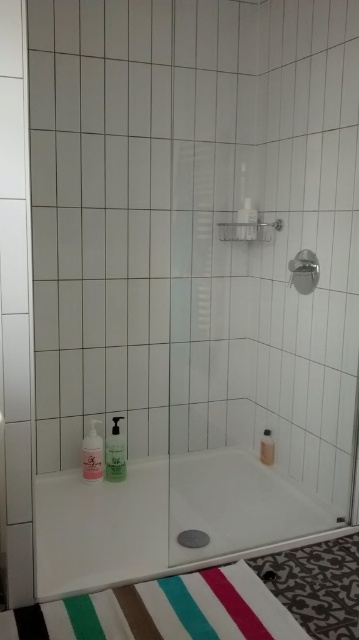
You are a contractor assessing the bathroom layout. You need to install a new showerhead that requires a minimum of 2 meters of clearance from the floor to the ceiling. Given the height difference between the white glossy bathtub at lower center and the white matte screen door at left, can you determine if the showerhead will fit?

The white glossy bathtub at lower center has a lesser height compared to the white matte screen door at left, but without specific measurements of the total ceiling height, it is impossible to confirm if the showerhead will fit. The height difference between the two objects does not provide information about the overall room height required for the installation.

You are designing a layout for a new shower and want to ensure proper placement of the metallic silver showerhead at upper right and the translucent plastic pump bottle at lower left. Based on their heights, which object should be placed higher to avoid water splashing onto the other?

The metallic silver showerhead at upper right has a lesser height compared to the translucent plastic pump bottle at lower left. To avoid water splashing onto the pump bottle, the showerhead should be placed higher than the pump bottle since it is shorter and water from it would not reach the taller bottle.

You are standing in the shower area and want to reach both the metallic silver showerhead at upper right and the translucent plastic pump bottle at lower left. Which object will you need to stretch your arm higher to reach?

The metallic silver showerhead at upper right is closer to the viewer than the translucent plastic pump bottle at lower left, so you will need to stretch your arm higher to reach the translucent plastic pump bottle at lower left.